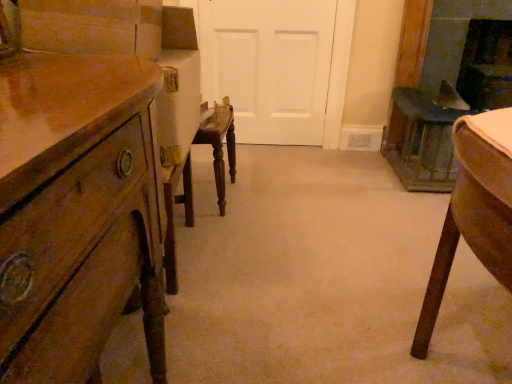
Question: Should I look upward or downward to see dark brown wood fireplace at upper right, the 2th fireplace viewed from the left?

Choices:
 (A) down
 (B) up

Answer: (B)

Question: Is dark gray stone fireplace at right, the first fireplace from the left, next to dark brown wood fireplace at upper right, the first fireplace in the right-to-left sequence?

Choices:
 (A) no
 (B) yes

Answer: (A)

Question: Is dark brown wood fireplace at upper right, the 2th fireplace viewed from the left, inside dark gray stone fireplace at right, marked as the 2th fireplace in a right-to-left arrangement?

Choices:
 (A) no
 (B) yes

Answer: (A)

Question: Is dark gray stone fireplace at right, marked as the 2th fireplace in a right-to-left arrangement, smaller than dark brown wood fireplace at upper right, the 2th fireplace viewed from the left?

Choices:
 (A) no
 (B) yes

Answer: (B)

Question: From the image's perspective, is dark gray stone fireplace at right, the first fireplace from the left, on dark brown wood fireplace at upper right, the first fireplace in the right-to-left sequence?

Choices:
 (A) no
 (B) yes

Answer: (A)

Question: Is dark gray stone fireplace at right, the first fireplace from the left, closer to the viewer compared to dark brown wood fireplace at upper right, the 2th fireplace viewed from the left?

Choices:
 (A) yes
 (B) no

Answer: (A)

Question: Considering the relative positions of dark gray stone fireplace at right, the first fireplace from the left, and dark brown wood fireplace at upper right, the first fireplace in the right-to-left sequence, in the image provided, is dark gray stone fireplace at right, the first fireplace from the left, behind dark brown wood fireplace at upper right, the first fireplace in the right-to-left sequence,?

Choices:
 (A) yes
 (B) no

Answer: (B)

Question: From a real-world perspective, is wooden chest of drawers at left on top of dark gray stone fireplace at right, the first fireplace from the left?

Choices:
 (A) yes
 (B) no

Answer: (B)

Question: Would you say wooden chest of drawers at left is a long distance from dark gray stone fireplace at right, the first fireplace from the left?

Choices:
 (A) yes
 (B) no

Answer: (A)

Question: Considering the relative sizes of wooden chest of drawers at left and dark gray stone fireplace at right, marked as the 2th fireplace in a right-to-left arrangement, in the image provided, is wooden chest of drawers at left thinner than dark gray stone fireplace at right, marked as the 2th fireplace in a right-to-left arrangement,?

Choices:
 (A) yes
 (B) no

Answer: (B)

Question: Is wooden chest of drawers at left at the right side of dark gray stone fireplace at right, marked as the 2th fireplace in a right-to-left arrangement?

Choices:
 (A) yes
 (B) no

Answer: (B)

Question: Is wooden chest of drawers at left beside dark gray stone fireplace at right, the first fireplace from the left?

Choices:
 (A) yes
 (B) no

Answer: (B)

Question: Can you confirm if wooden chest of drawers at left is positioned to the left of dark gray stone fireplace at right, marked as the 2th fireplace in a right-to-left arrangement?

Choices:
 (A) yes
 (B) no

Answer: (A)

Question: Could you tell me if white matte door at center is turned towards dark brown wood fireplace at upper right, the first fireplace in the right-to-left sequence?

Choices:
 (A) yes
 (B) no

Answer: (B)